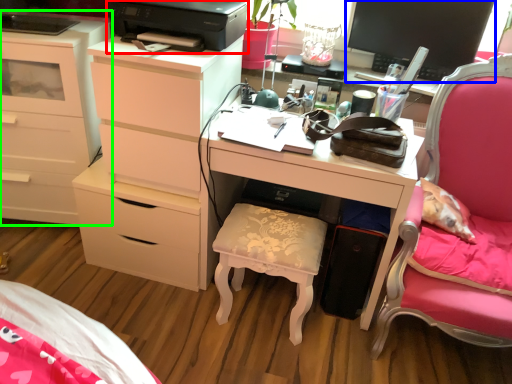
Question: Considering the real-world distances, which object is farthest from printer (highlighted by a red box)? computer monitor (highlighted by a blue box) or chest of drawers (highlighted by a green box)?

Choices:
 (A) computer monitor
 (B) chest of drawers

Answer: (A)